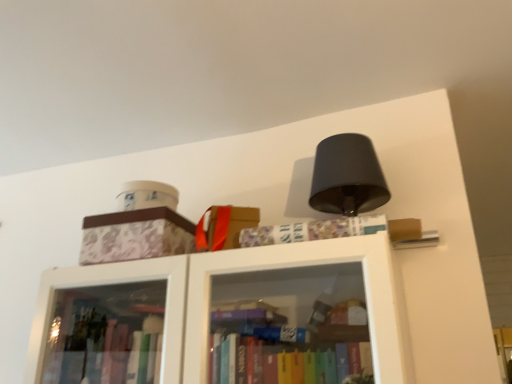
Question: Does patterned paper book at upper center turn towards patterned cardboard box at upper left?

Choices:
 (A) no
 (B) yes

Answer: (A)

Question: Is patterned paper book at upper center taller than patterned cardboard box at upper left?

Choices:
 (A) yes
 (B) no

Answer: (B)

Question: Considering the relative sizes of patterned paper book at upper center and patterned cardboard box at upper left in the image provided, is patterned paper book at upper center smaller than patterned cardboard box at upper left?

Choices:
 (A) yes
 (B) no

Answer: (A)

Question: Does patterned paper book at upper center come behind patterned cardboard box at upper left?

Choices:
 (A) yes
 (B) no

Answer: (B)

Question: Does patterned paper book at upper center have a lesser height compared to patterned cardboard box at upper left?

Choices:
 (A) no
 (B) yes

Answer: (B)

Question: From the image's perspective, is patterned paper book at upper center beneath patterned cardboard box at upper left?

Choices:
 (A) yes
 (B) no

Answer: (B)

Question: From a real-world perspective, is patterned cardboard box at upper left positioned under patterned paper book at upper center based on gravity?

Choices:
 (A) yes
 (B) no

Answer: (B)

Question: Is patterned cardboard box at upper left positioned with its back to patterned paper book at upper center?

Choices:
 (A) yes
 (B) no

Answer: (B)

Question: From a real-world perspective, is patterned cardboard box at upper left on top of patterned paper book at upper center?

Choices:
 (A) no
 (B) yes

Answer: (B)

Question: Are patterned cardboard box at upper left and patterned paper book at upper center beside each other?

Choices:
 (A) no
 (B) yes

Answer: (A)

Question: Can you confirm if patterned cardboard box at upper left is bigger than patterned paper book at upper center?

Choices:
 (A) no
 (B) yes

Answer: (B)

Question: Does patterned cardboard box at upper left have a lesser height compared to patterned paper book at upper center?

Choices:
 (A) no
 (B) yes

Answer: (A)

Question: From the image's perspective, relative to patterned paper book at upper center, is patterned cardboard box at upper left above or below?

Choices:
 (A) above
 (B) below

Answer: (B)